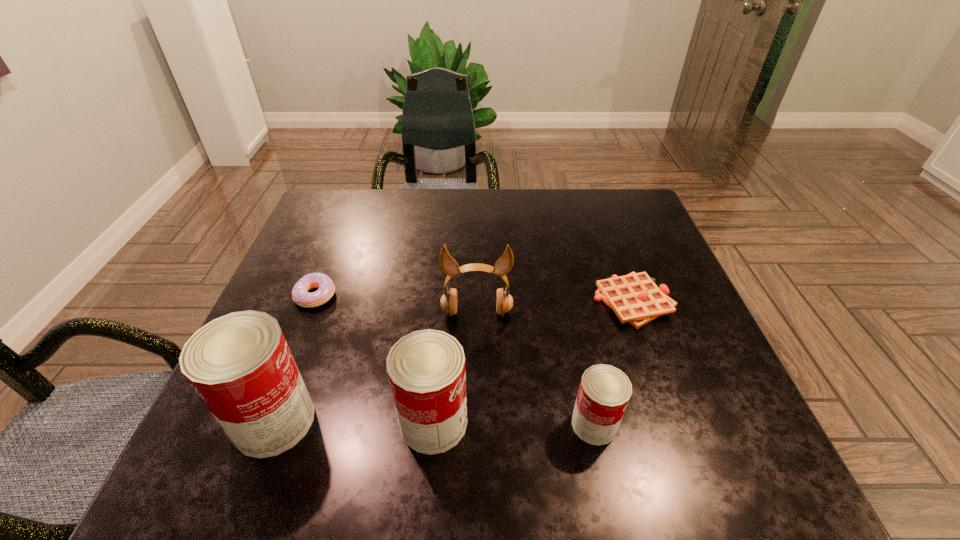
Locate an element on the screen. Image resolution: width=960 pixels, height=540 pixels. free space between the leftmost can and the earphone is located at coordinates pos(375,366).

What are the coordinates of `free space between the doughnut and the second tallest can` in the screenshot? It's located at (374, 359).

Locate an element on the screen. Image resolution: width=960 pixels, height=540 pixels. vacant space in between the earphone and the doughnut is located at coordinates (396, 304).

Locate an element on the screen. object that stands as the closest to the leftmost can is located at coordinates (426, 369).

This screenshot has height=540, width=960. What are the coordinates of `the fourth closest object to the earphone` in the screenshot? It's located at (300, 295).

You are a GUI agent. You are given a task and a screenshot of the screen. Output one action in this format:
    pyautogui.click(x=<x>, y=<y>)
    Task: Click on the can that is the second closest to the rightmost can
    
    Given the screenshot: What is the action you would take?
    pyautogui.click(x=240, y=365)

This screenshot has height=540, width=960. Find the location of `the closest can to the leftmost can`. the closest can to the leftmost can is located at coordinates (426, 369).

This screenshot has height=540, width=960. What are the coordinates of `free space that satisfies the following two spatial constraints: 1. on the front side of the rightmost object; 2. on the front label of the second tallest can` in the screenshot? It's located at (678, 422).

This screenshot has height=540, width=960. I want to click on free space that satisfies the following two spatial constraints: 1. on the front-facing side of the earphone; 2. on the front label of the second tallest can, so click(x=476, y=422).